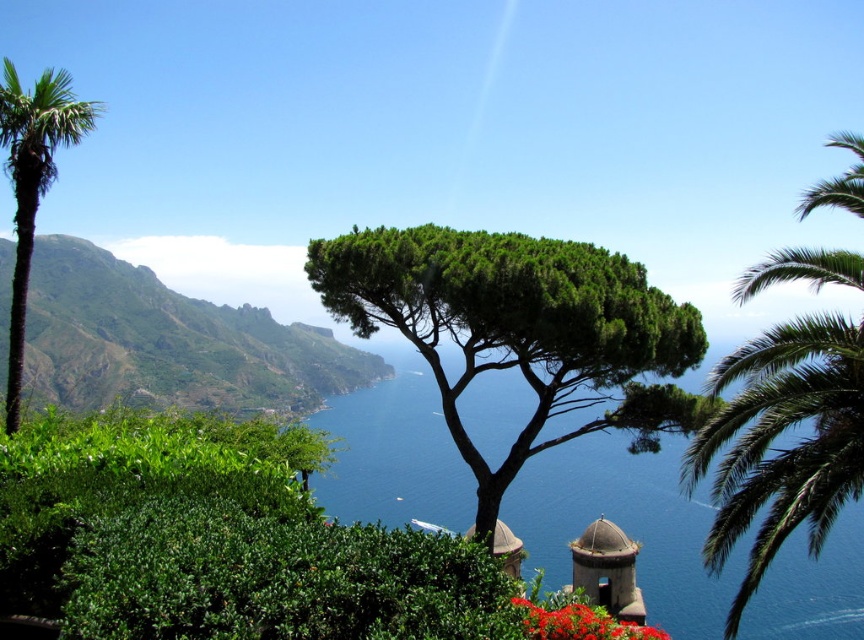
Question: Is green leafy tree at center positioned before green leafy palm tree at left?

Choices:
 (A) no
 (B) yes

Answer: (B)

Question: Which of these objects is positioned closest to the blue water at center?

Choices:
 (A) green leafy palm tree at left
 (B) green leafy tree at center
 (C) green leafy hillside at upper left

Answer: (C)

Question: Which object is closer to the camera taking this photo?

Choices:
 (A) green leafy tree at center
 (B) blue water at center
 (C) green leafy hillside at upper left

Answer: (B)

Question: Observing the image, what is the correct spatial positioning of green leafy palm tree at right in reference to green leafy palm tree at left?

Choices:
 (A) right
 (B) left

Answer: (A)

Question: Is green leafy palm tree at right below bright red petals at center?

Choices:
 (A) no
 (B) yes

Answer: (B)

Question: Which of the following is the farthest from the observer?

Choices:
 (A) (627, 625)
 (B) (740, 493)
 (C) (14, 397)

Answer: (C)